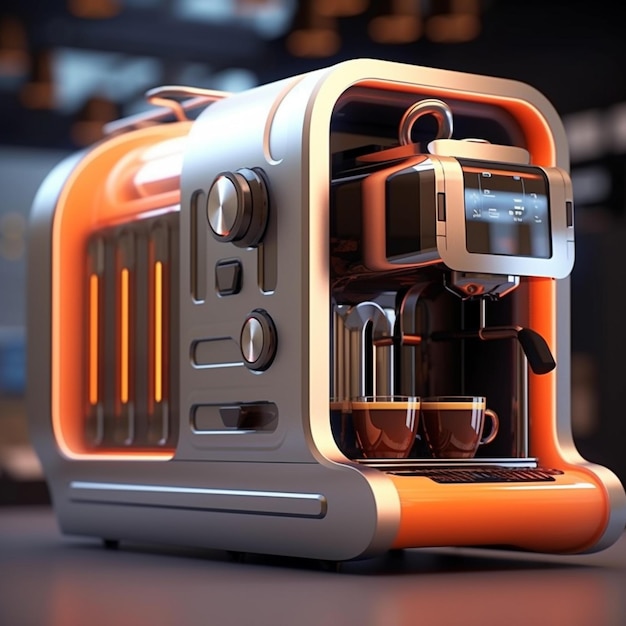
Locate an element on the screen. The image size is (626, 626). handle is located at coordinates (546, 354).